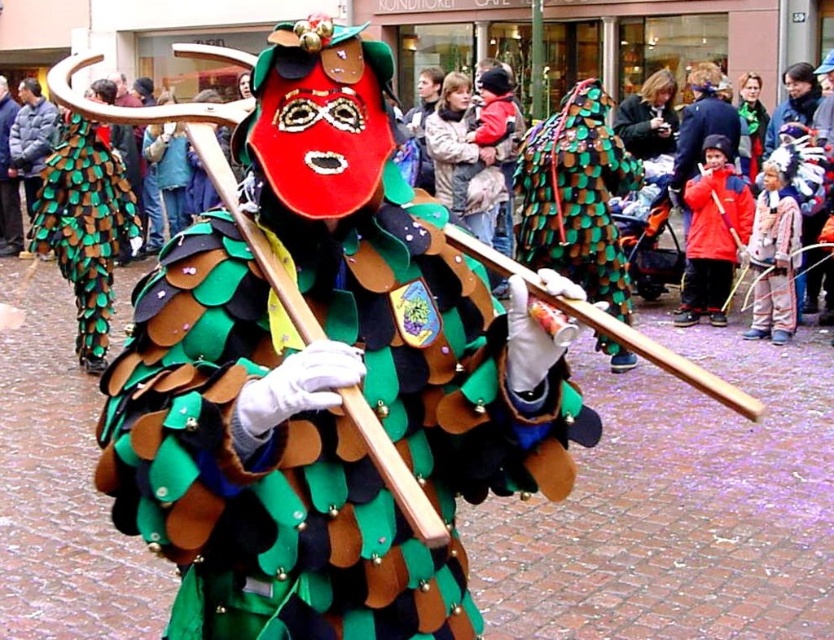
Question: Which is nearer to the green felt costume at center?

Choices:
 (A) matte red mask at center
 (B) green textured scales at center
 (C) white cotton sweater at right
 (D) green felt scales at center

Answer: (B)

Question: Can you confirm if green felt scales at center is positioned to the left of white cotton sweater at right?

Choices:
 (A) yes
 (B) no

Answer: (A)

Question: Among these objects, which one is farthest from the camera?

Choices:
 (A) green felt costume at center
 (B) green felt scales at center

Answer: (B)

Question: Does green felt scales at center appear on the left side of matte red mask at center?

Choices:
 (A) yes
 (B) no

Answer: (A)

Question: Which is farther from the green felt scales at center?

Choices:
 (A) green textured scales at center
 (B) green felt costume at center

Answer: (B)

Question: Is green felt scales at center wider than white cotton sweater at right?

Choices:
 (A) yes
 (B) no

Answer: (A)